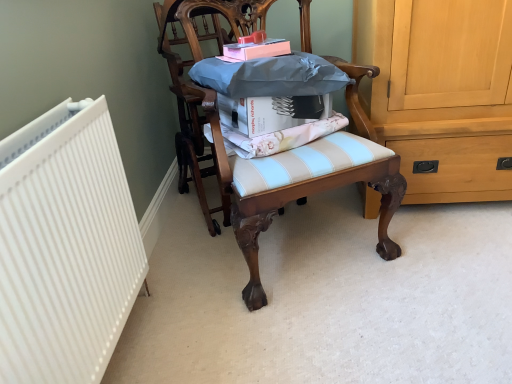
Question: From a real-world perspective, does light blue striped cushion at center sit lower than wooden chair at center, arranged as the first chair when viewed from the right?

Choices:
 (A) yes
 (B) no

Answer: (B)

Question: Is light blue striped cushion at center to the left of wooden chair at center, which is the 2th chair from left to right, from the viewer's perspective?

Choices:
 (A) no
 (B) yes

Answer: (B)

Question: Is light blue striped cushion at center facing away from wooden chair at center, arranged as the first chair when viewed from the right?

Choices:
 (A) yes
 (B) no

Answer: (A)

Question: Could you tell me if light blue striped cushion at center is facing wooden chair at center, which is the 2th chair from left to right?

Choices:
 (A) yes
 (B) no

Answer: (A)

Question: Can you confirm if light blue striped cushion at center is taller than wooden chair at center, arranged as the first chair when viewed from the right?

Choices:
 (A) no
 (B) yes

Answer: (A)

Question: Can you see light blue striped cushion at center touching wooden chair at center, arranged as the first chair when viewed from the right?

Choices:
 (A) no
 (B) yes

Answer: (A)

Question: Does white matte book at center, acting as the second book starting from the top, have a greater width compared to wooden chair at center, placed as the first chair when sorted from left to right?

Choices:
 (A) yes
 (B) no

Answer: (B)

Question: Could you tell me if white matte book at center, acting as the second book starting from the top, is facing wooden chair at center, which ranks as the 2th chair in right-to-left order?

Choices:
 (A) no
 (B) yes

Answer: (A)

Question: Can you confirm if white matte book at center, positioned as the 1th book in bottom-to-top order, is shorter than wooden chair at center, which ranks as the 2th chair in right-to-left order?

Choices:
 (A) no
 (B) yes

Answer: (B)

Question: Is white matte book at center, positioned as the 1th book in bottom-to-top order, not within wooden chair at center, placed as the first chair when sorted from left to right?

Choices:
 (A) yes
 (B) no

Answer: (A)

Question: Is white matte book at center, acting as the second book starting from the top, far from wooden chair at center, placed as the first chair when sorted from left to right?

Choices:
 (A) no
 (B) yes

Answer: (A)

Question: Is white matte book at center, positioned as the 1th book in bottom-to-top order, surrounding wooden chair at center, which ranks as the 2th chair in right-to-left order?

Choices:
 (A) yes
 (B) no

Answer: (B)

Question: Can you confirm if white matte book at center, positioned as the 1th book in bottom-to-top order, is smaller than pink matte book at upper center, marked as the 2th book in a bottom-to-top arrangement?

Choices:
 (A) no
 (B) yes

Answer: (A)